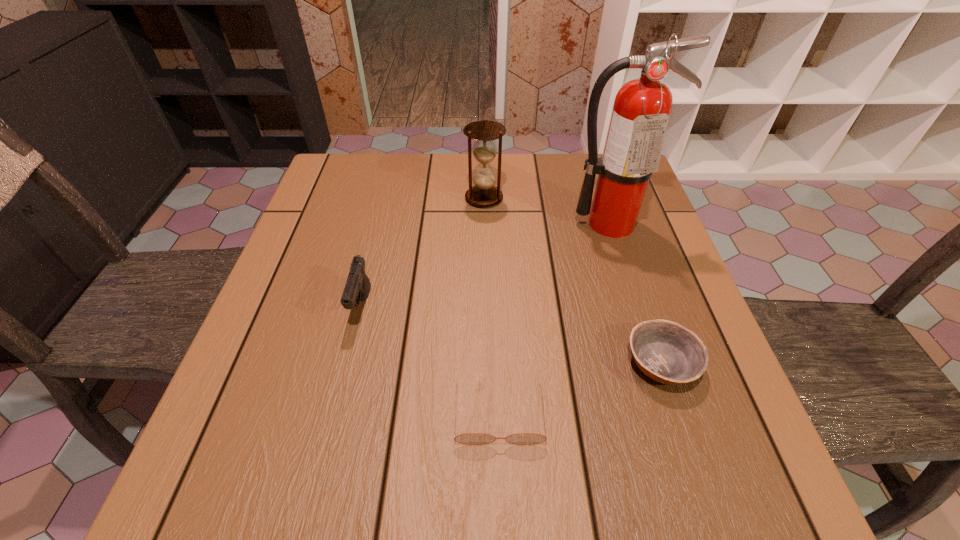
Where is `fire extinguisher`? Image resolution: width=960 pixels, height=540 pixels. fire extinguisher is located at coordinates (641, 110).

Where is `hourglass`? This screenshot has width=960, height=540. hourglass is located at coordinates (484, 194).

Image resolution: width=960 pixels, height=540 pixels. In order to click on the third farthest object in this screenshot , I will do `click(357, 287)`.

In order to click on the leftmost object in this screenshot , I will do `click(357, 287)`.

Locate an element on the screen. bowl is located at coordinates (669, 353).

Where is `sunglasses`? The image size is (960, 540). sunglasses is located at coordinates (469, 438).

Find the location of a particular element. The image size is (960, 540). vacant space positioned on the nozzle side of the tallest object is located at coordinates (663, 389).

You are a GUI agent. You are given a task and a screenshot of the screen. Output one action in this format:
    pyautogui.click(x=<x>, y=<y>)
    Task: Click on the vacant space situated on the left of the fourth shortest object
    This screenshot has height=540, width=960.
    Given the screenshot: What is the action you would take?
    click(x=393, y=198)

This screenshot has height=540, width=960. I want to click on free space located 0.320m at the barrel of the third tallest object, so click(x=313, y=509).

Where is `free space located on the back of the bowl`? The height and width of the screenshot is (540, 960). free space located on the back of the bowl is located at coordinates (621, 241).